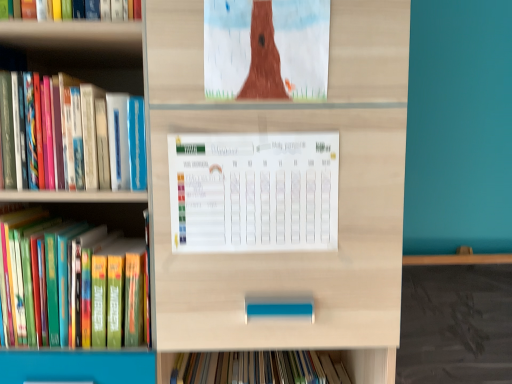
Question: From a real-world perspective, relative to matte brown tree at upper center, is hardcover book at left, which appears as the second book when viewed from the top, vertically above or below?

Choices:
 (A) above
 (B) below

Answer: (B)

Question: In the image, is hardcover book at left, which appears as the second book when viewed from the top, positioned in front of or behind matte brown tree at upper center?

Choices:
 (A) behind
 (B) front

Answer: (A)

Question: Which object is positioned closest to the white paper calendar at center?

Choices:
 (A) matte brown tree at upper center
 (B) hardcover book at left, placed as the second book when sorted from bottom to top
 (C) hardcover book at left, which appears as the second book when viewed from the top

Answer: (A)

Question: Based on their relative distances, which object is farther from the white paper calendar at center?

Choices:
 (A) hardcover book at left, placed as the second book when sorted from bottom to top
 (B) matte brown tree at upper center
 (C) hardcover book at left, which appears as the second book when viewed from the top

Answer: (C)